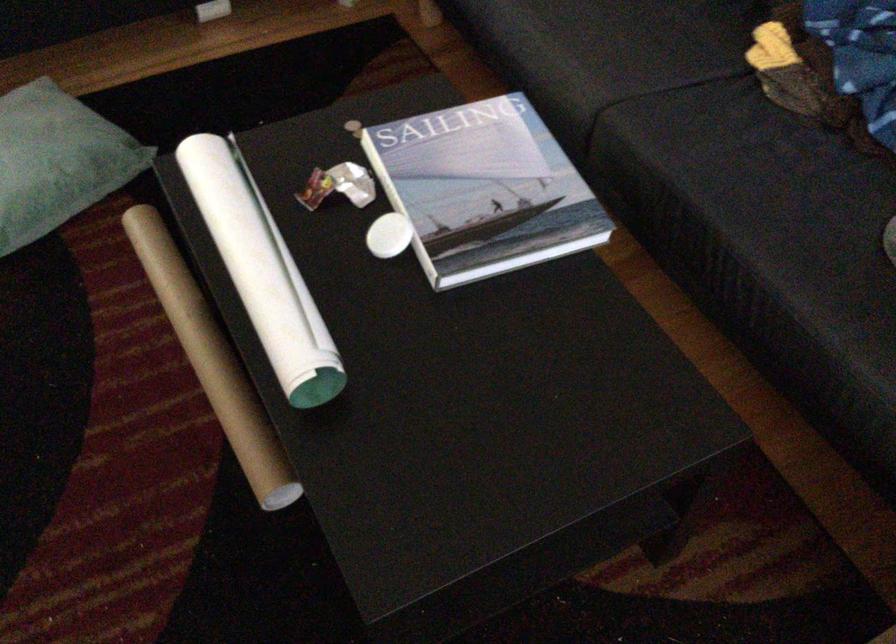
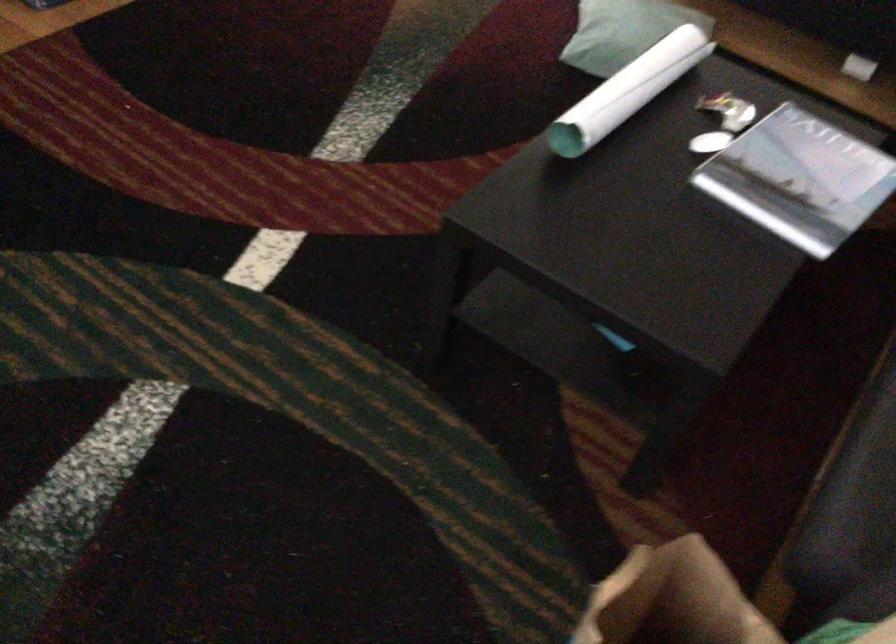
Question: The images are taken continuously from a first-person perspective. In which direction is your viewpoint rotating?

Choices:
 (A) Left
 (B) Right
 (C) Up
 (D) Down

Answer: (A)